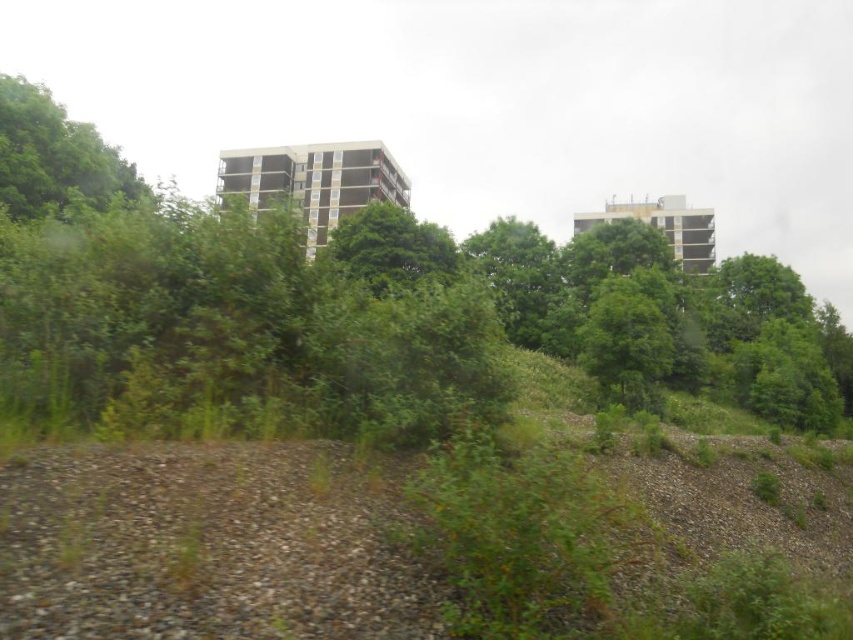
You are an urban planner reviewing this area. You notice the green leafy tree at upper center and the green leafy tree at upper left. Which tree would block the view of the other when looking from the foreground towards the mid and background?

The green leafy tree at upper center is in front of the green leafy tree at upper left, so it would block the view of the green leafy tree at upper left when looking from the foreground towards the mid and background.

You are standing at the point marked at coordinates (364, 308) in the image. Based on the scene description, what type of vegetation are you likely surrounded by?

The point at (364, 308) is on a green leafy tree at upper center, so you are surrounded by lush, dense foliage from the tree.

Based on the scene description, where is the green leafy tree at upper center located in terms of the coordinate system provided?

The green leafy tree at upper center is located at point coordinates of (x=364, y=308).